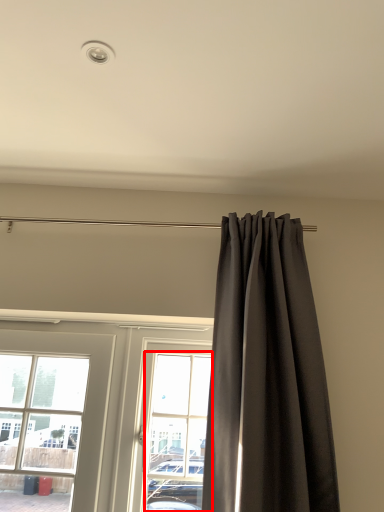
Question: Where is bay window (annotated by the red box) located in relation to curtain in the image?

Choices:
 (A) right
 (B) left

Answer: (B)